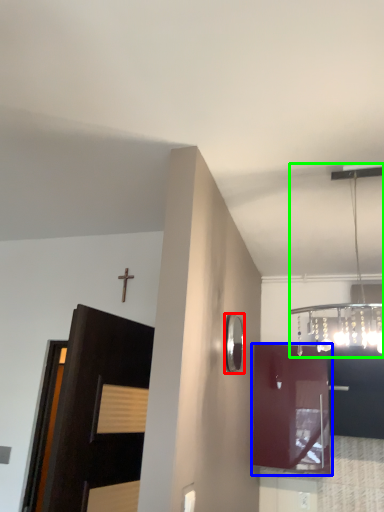
Question: Estimate the real-world distances between objects in this image. Which object is farther from mirror (highlighted by a red box), cabinetry (highlighted by a blue box) or light fixture (highlighted by a green box)?

Choices:
 (A) cabinetry
 (B) light fixture

Answer: (A)